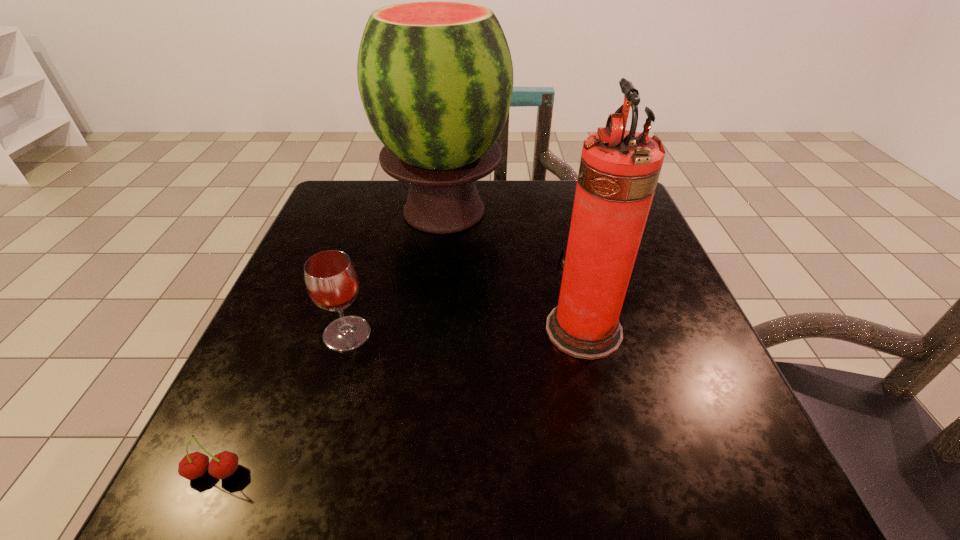
This screenshot has width=960, height=540. In order to click on object that is the third closest to the watermelon in this screenshot , I will do `click(194, 465)`.

Select which object is the third closest to the watermelon. Please provide its 2D coordinates. Your answer should be formatted as a tuple, i.e. [(x, y)], where the tuple contains the x and y coordinates of a point satisfying the conditions above.

[(194, 465)]

Where is `free location that satisfies the following two spatial constraints: 1. on the back side of the farthest object; 2. on the right side of the wineglass`? This screenshot has width=960, height=540. free location that satisfies the following two spatial constraints: 1. on the back side of the farthest object; 2. on the right side of the wineglass is located at coordinates (x=384, y=211).